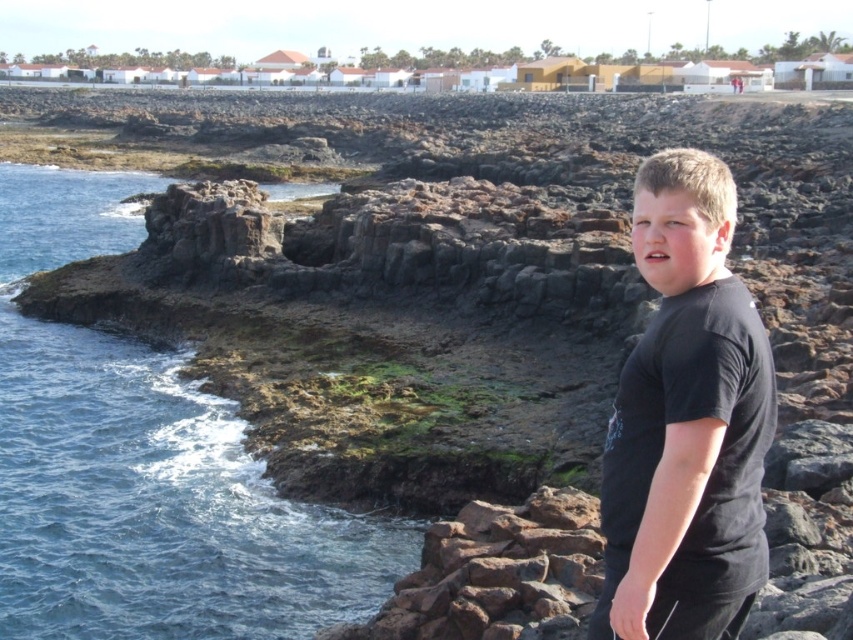
You are a photographer trying to capture the scene with the blue water at left and the black matte shirt at right. Which object appears larger in the photo?

The blue water at left appears larger in the photo because it is much taller than the black matte shirt at right.

Consider the image. You are standing on the rocky outcrop and want to move towards the blue water at left without stepping on the black matte shirt at right. Which direction should you move?

You should move to the left because the blue water at left is located to the left of the black matte shirt at right, so moving left will take you towards the water while avoiding the shirt.

You are a photographer trying to capture a wide shot of the coastal scene. You notice the blue water at left and the black matte shirt at right in your frame. Based on their sizes in the image, which object would appear closer to the camera?

The blue water at left appears closer to the camera because it has a larger size compared to the black matte shirt at right.